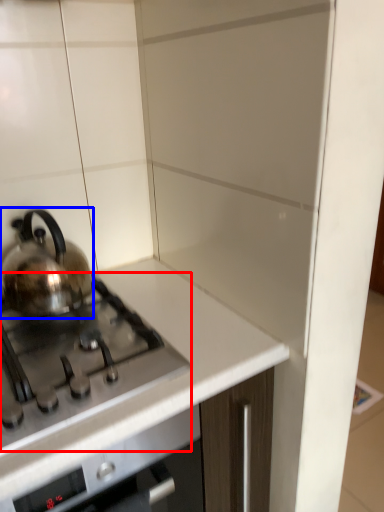
Question: Which object is closer to the camera taking this photo, gas stove (highlighted by a red box) or kettle (highlighted by a blue box)?

Choices:
 (A) gas stove
 (B) kettle

Answer: (A)